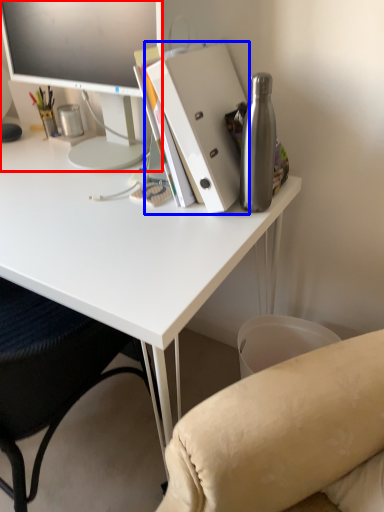
Question: Which of the following is the closest to the observer, television (highlighted by a red box) or paperback book (highlighted by a blue box)?

Choices:
 (A) television
 (B) paperback book

Answer: (B)